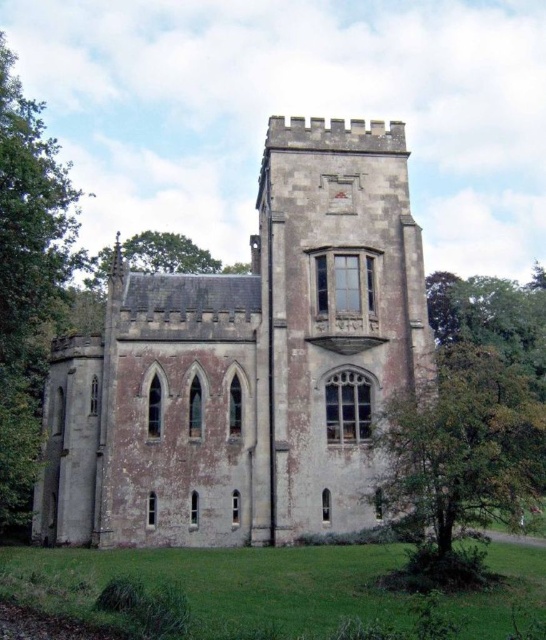
Question: Is gray stone castle at center to the left of green leafy tree at right from the viewer's perspective?

Choices:
 (A) no
 (B) yes

Answer: (B)

Question: Which point is farther to the camera?

Choices:
 (A) (14, 88)
 (B) (288, 326)

Answer: (A)

Question: Does green leafy tree at right appear on the left side of green leafy tree at left?

Choices:
 (A) yes
 (B) no

Answer: (B)

Question: Among these objects, which one is nearest to the camera?

Choices:
 (A) green leafy tree at left
 (B) green leafy tree at right
 (C) gray stone castle at center

Answer: (B)

Question: Can you confirm if gray stone castle at center is wider than green leafy tree at left?

Choices:
 (A) yes
 (B) no

Answer: (B)

Question: Which object appears closest to the camera in this image?

Choices:
 (A) green leafy tree at right
 (B) gray stone castle at center
 (C) green leafy tree at left

Answer: (A)